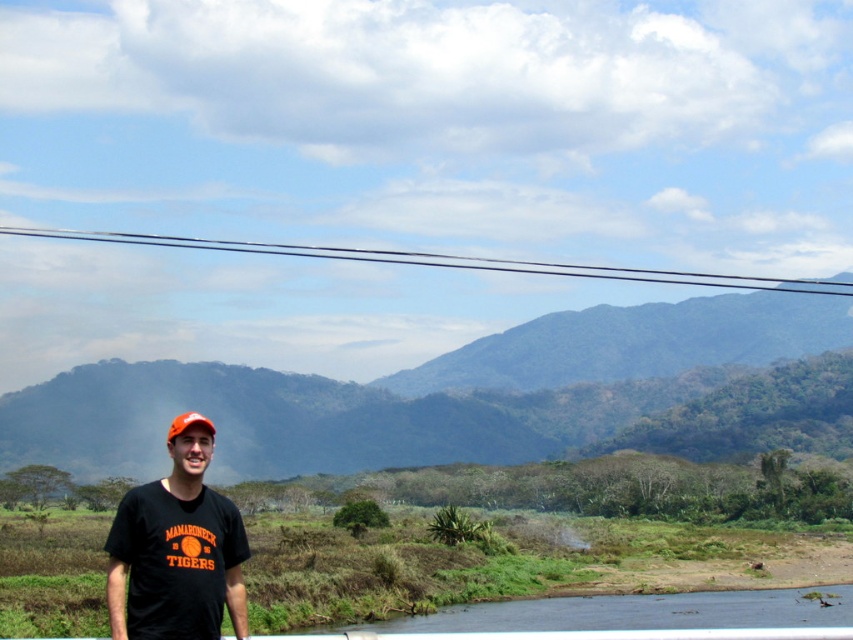
Question: Is green leafy forest at center closer to camera compared to orange matte baseball cap at center?

Choices:
 (A) yes
 (B) no

Answer: (B)

Question: In this image, where is black matte t-shirt at lower left located relative to black wire at upper center?

Choices:
 (A) below
 (B) above

Answer: (A)

Question: Which object is farther from the camera taking this photo?

Choices:
 (A) black wire at upper center
 (B) black matte t-shirt at lower left
 (C) green leafy forest at center

Answer: (C)

Question: Which point is closer to the camera?

Choices:
 (A) (392, 252)
 (B) (172, 577)
 (C) (210, 420)
 (D) (822, 300)

Answer: (B)

Question: Estimate the real-world distances between objects in this image. Which object is farther from the black matte t-shirt at lower left?

Choices:
 (A) black wire at upper center
 (B) orange matte baseball cap at center

Answer: (A)

Question: In this image, where is black matte t-shirt at lower left located relative to black wire at upper center?

Choices:
 (A) right
 (B) left

Answer: (B)